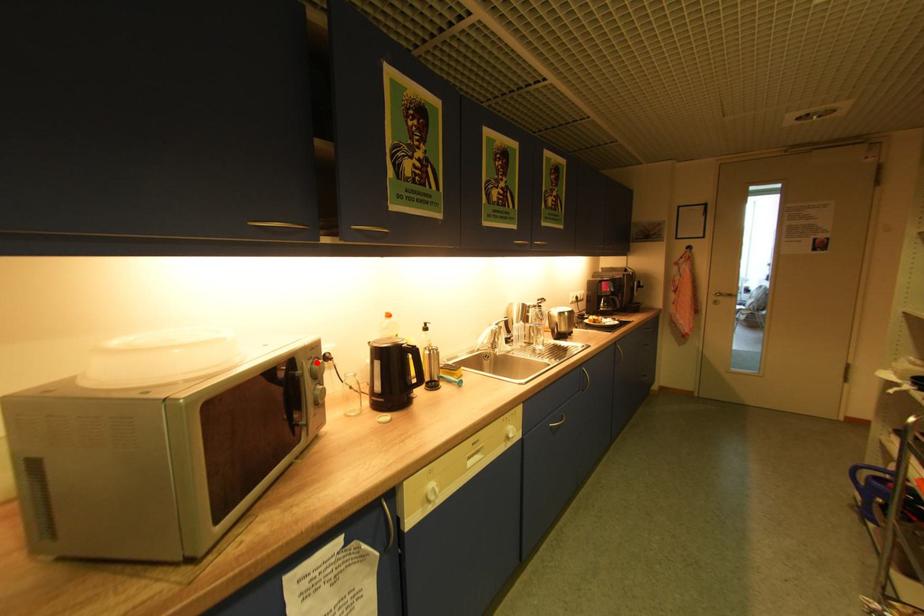
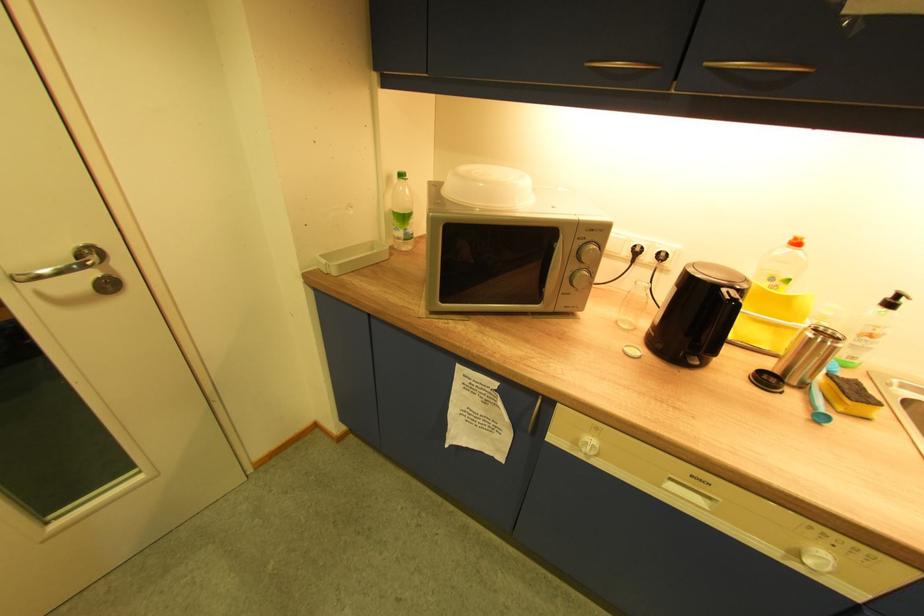
Locate, in the second image, the point that corresponds to the highlighted location in the first image.

(589, 243)